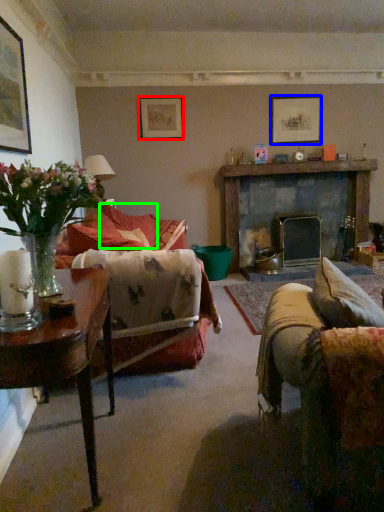
Question: Considering the real-world distances, which object is farthest from picture frame (highlighted by a red box)? picture frame (highlighted by a blue box) or pillow (highlighted by a green box)?

Choices:
 (A) picture frame
 (B) pillow

Answer: (A)